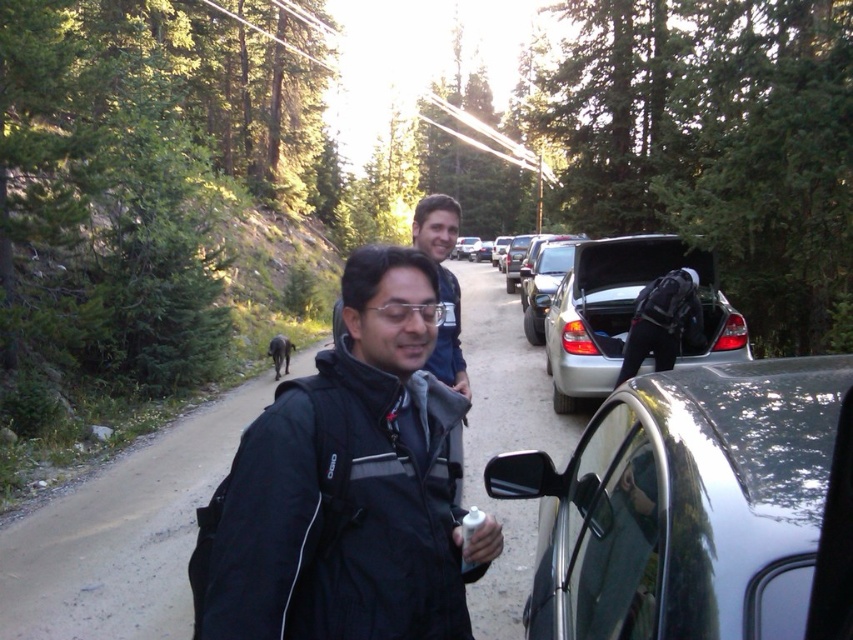
Question: Can you confirm if satin silver suv at right is positioned to the right of satin silver car at center?

Choices:
 (A) no
 (B) yes

Answer: (A)

Question: Which object is positioned closest to the satin silver car at center?

Choices:
 (A) black softshell jacket at center
 (B) shiny black car at right
 (C) matte blue shirt at center
 (D) satin silver suv at right

Answer: (C)

Question: Is satin silver suv at right thinner than satin silver car at center?

Choices:
 (A) no
 (B) yes

Answer: (B)

Question: Which point is closer to the camera?

Choices:
 (A) (476, 257)
 (B) (331, 502)

Answer: (B)

Question: Which object appears closest to the camera in this image?

Choices:
 (A) black softshell jacket at center
 (B) satin silver suv at right
 (C) satin silver car at center

Answer: (A)

Question: Is matte blue shirt at center positioned before satin silver car at center?

Choices:
 (A) yes
 (B) no

Answer: (A)